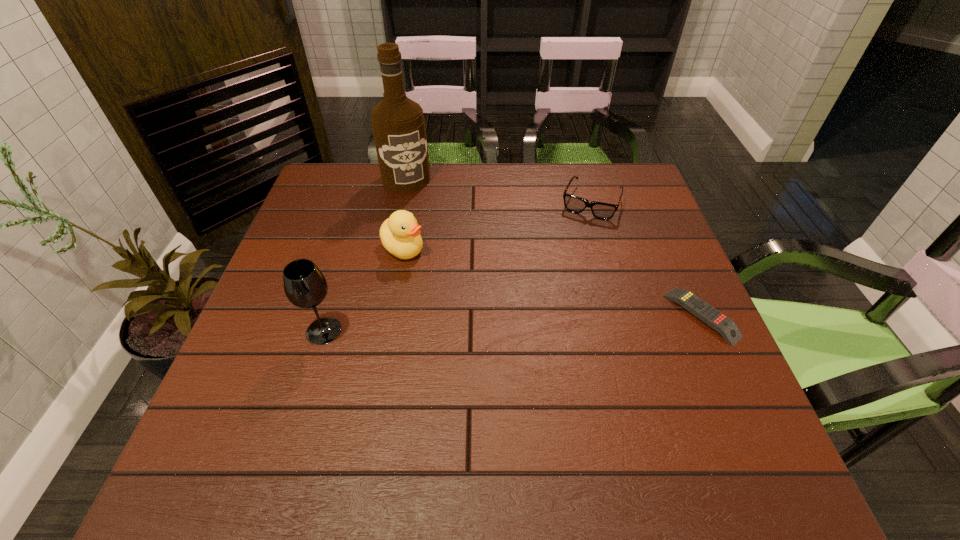
I want to click on free location at the near left corner of the desktop, so (x=232, y=426).

The height and width of the screenshot is (540, 960). I want to click on vacant space at the far right corner, so tap(616, 199).

The height and width of the screenshot is (540, 960). I want to click on free spot between the third farthest object and the fourth shortest object, so click(x=364, y=289).

I want to click on free spot between the tallest object and the rightmost object, so click(x=554, y=247).

At what (x,y) coordinates should I click in order to perform the action: click on free space between the second shortest object and the rightmost object. Please return your answer as a coordinate pair (x, y). The width and height of the screenshot is (960, 540). Looking at the image, I should click on (646, 259).

Find the location of a particular element. unoccupied area between the duck and the second tallest object is located at coordinates (364, 289).

Locate an element on the screen. free spot between the alcohol and the shortest object is located at coordinates (554, 247).

This screenshot has height=540, width=960. I want to click on free spot between the rightmost object and the tallest object, so click(x=554, y=247).

Locate an element on the screen. vacant space that's between the second object from right to left and the rightmost object is located at coordinates (646, 259).

What are the coordinates of `vacant area between the tallest object and the fourth tallest object` in the screenshot? It's located at (498, 191).